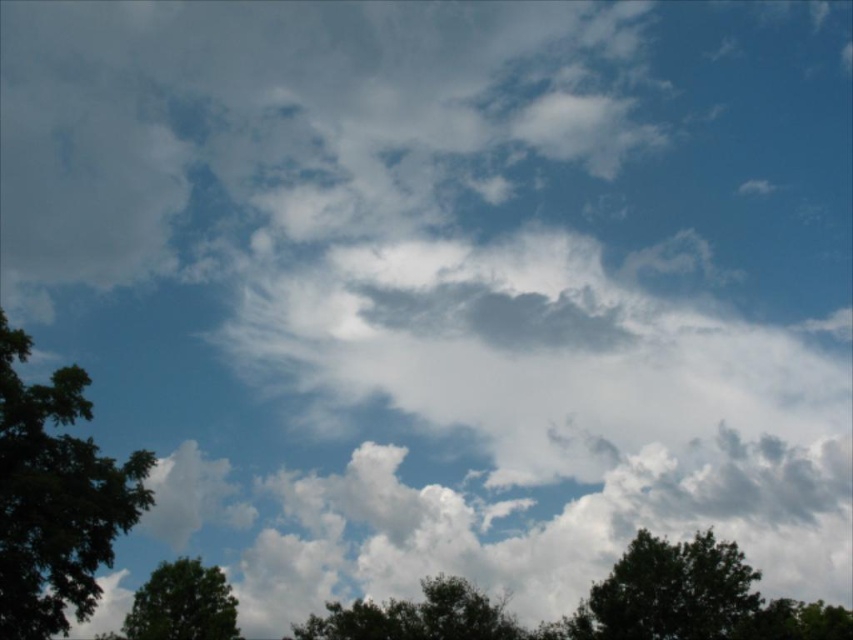
Who is taller, green leafy tree at left or dark green leafy tree at lower right?

green leafy tree at left is taller.

Between green leafy tree at left and dark green leafy tree at lower right, which one is positioned lower?

dark green leafy tree at lower right

Who is more distant from viewer, (85, 570) or (663, 632)?

Point (663, 632)

The width and height of the screenshot is (853, 640). I want to click on green leafy tree at left, so click(x=55, y=497).

Who is lower down, dark green leafy tree at lower right or green leafy tree at center?

green leafy tree at center is lower down.

Consider the image. Does dark green leafy tree at lower right appear on the left side of green leafy tree at center?

Incorrect, dark green leafy tree at lower right is not on the left side of green leafy tree at center.

Does point (744, 602) come closer to viewer compared to point (343, 628)?

That is True.

Identify the location of dark green leafy tree at lower right. (669, 593).

Based on the photo, does green leafy tree at left have a greater height compared to green leafy tree at center?

Indeed, green leafy tree at left has a greater height compared to green leafy tree at center.

Who is higher up, green leafy tree at left or green leafy tree at center?

green leafy tree at left

Between point (3, 432) and point (451, 632), which one is positioned in front?

Point (3, 432) is in front.

The height and width of the screenshot is (640, 853). Identify the location of green leafy tree at left. (55, 497).